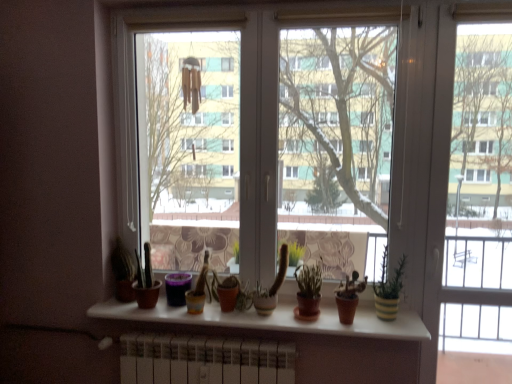
Question: Considering the relative sizes of yellow striped pot at right and white matte window sill at center in the image provided, is yellow striped pot at right thinner than white matte window sill at center?

Choices:
 (A) no
 (B) yes

Answer: (B)

Question: Considering the relative positions of yellow striped pot at right and white matte window sill at center in the image provided, is yellow striped pot at right to the right of white matte window sill at center from the viewer's perspective?

Choices:
 (A) yes
 (B) no

Answer: (A)

Question: Can you see yellow striped pot at right touching white matte window sill at center?

Choices:
 (A) no
 (B) yes

Answer: (A)

Question: Is the position of yellow striped pot at right less distant than that of white matte window sill at center?

Choices:
 (A) yes
 (B) no

Answer: (B)

Question: Can you confirm if yellow striped pot at right is taller than white matte window sill at center?

Choices:
 (A) yes
 (B) no

Answer: (A)

Question: In the image, is matte brown pot at center positioned in front of or behind yellow striped pot at right?

Choices:
 (A) behind
 (B) front

Answer: (A)

Question: Is point (220, 286) closer or farther from the camera than point (391, 283)?

Choices:
 (A) closer
 (B) farther

Answer: (B)

Question: Based on their positions, is matte brown pot at center located to the left or right of yellow striped pot at right?

Choices:
 (A) left
 (B) right

Answer: (A)

Question: In terms of width, does matte brown pot at center look wider or thinner when compared to yellow striped pot at right?

Choices:
 (A) wide
 (B) thin

Answer: (A)

Question: Is transparent glass screen door at center inside the boundaries of transparent glass window at center, or outside?

Choices:
 (A) inside
 (B) outside

Answer: (B)

Question: Considering the positions of transparent glass screen door at center and transparent glass window at center in the image, is transparent glass screen door at center taller or shorter than transparent glass window at center?

Choices:
 (A) short
 (B) tall

Answer: (B)

Question: Considering their positions, is transparent glass screen door at center located in front of or behind transparent glass window at center?

Choices:
 (A) front
 (B) behind

Answer: (A)

Question: Looking at their shapes, would you say transparent glass screen door at center is wider or thinner than transparent glass window at center?

Choices:
 (A) wide
 (B) thin

Answer: (B)

Question: Is yellow striped pot at right in front of or behind matte brown pot at center in the image?

Choices:
 (A) front
 (B) behind

Answer: (A)

Question: Is yellow striped pot at right inside the boundaries of matte brown pot at center, or outside?

Choices:
 (A) outside
 (B) inside

Answer: (A)